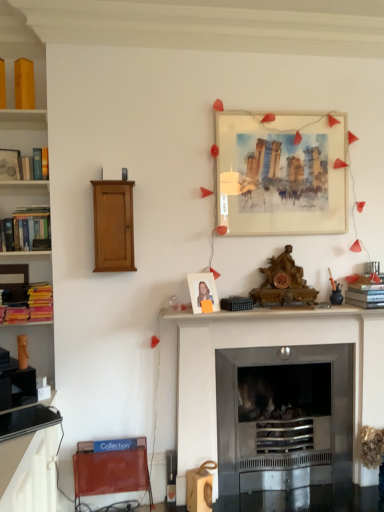
Identify the location of matte paper picture frame at upper center, which ranks as the second picture frame in front-to-back order. (280, 174).

You are a GUI agent. You are given a task and a screenshot of the screen. Output one action in this format:
    pyautogui.click(x=<x>, y=<y>)
    Task: Click on the hardcover books at left
    
    Given the screenshot: What is the action you would take?
    pyautogui.click(x=26, y=215)

In order to face hardcover book at left, the 1th book positioned from the top, should I rotate leftwards or rightwards?

Turn left approximately 20.259 degrees to face it.

What do you see at coordinates (268, 345) in the screenshot? I see `metallic silver fireplace at center` at bounding box center [268, 345].

You are a GUI agent. You are given a task and a screenshot of the screen. Output one action in this format:
    pyautogui.click(x=<x>, y=<y>)
    Task: Click on the matte paper picture frame at upper center, the second picture frame when ordered from left to right
    
    Given the screenshot: What is the action you would take?
    pyautogui.click(x=280, y=174)

Considering the relative sizes of matte white photo frame at center, which is the 1th picture frame from left to right, and hardcover book at left, the 1th book positioned from the top, in the image provided, is matte white photo frame at center, which is the 1th picture frame from left to right, shorter than hardcover book at left, the 1th book positioned from the top,?

No, matte white photo frame at center, which is the 1th picture frame from left to right, is not shorter than hardcover book at left, the 1th book positioned from the top.

Is matte white photo frame at center, which is the 1th picture frame from left to right, positioned behind hardcover book at left, the second book positioned from the right?

That is False.

From the image's perspective, which is below, matte white photo frame at center, which is the 2th picture frame from top to bottom, or hardcover book at left, arranged as the 1th book when viewed from the left?

matte white photo frame at center, which is the 2th picture frame from top to bottom, is shown below in the image.

The width and height of the screenshot is (384, 512). What are the coordinates of `the 2nd book above the matte white photo frame at center, the 1th picture frame ordered from the bottom (from the image's perspective)` in the screenshot? It's located at (21, 165).

From a real-world perspective, who is located lower, hardcover books at left or hardcover book at right, placed as the 2th book when sorted from top to bottom?

In real-world perspective, hardcover book at right, placed as the 2th book when sorted from top to bottom, is lower.

Based on the photo, is hardcover books at left positioned with its back to hardcover book at right, the second book positioned from the left?

No, hardcover books at left's orientation is not away from hardcover book at right, the second book positioned from the left.

Is hardcover books at left at the right side of hardcover book at right, the second book positioned from the left?

In fact, hardcover books at left is to the left of hardcover book at right, the second book positioned from the left.

Are hardcover books at left and hardcover book at right, the second book positioned from the left, beside each other?

No, hardcover books at left is not in contact with hardcover book at right, the second book positioned from the left.

Is point (247, 137) in front of point (382, 327)?

Yes.

In the scene shown: Considering the positions of objects matte paper picture frame at upper center, placed as the 1th picture frame when sorted from right to left, and metallic silver fireplace at center in the image provided, who is in front, matte paper picture frame at upper center, placed as the 1th picture frame when sorted from right to left, or metallic silver fireplace at center?

metallic silver fireplace at center.

Considering the sizes of objects matte paper picture frame at upper center, which ranks as the second picture frame in bottom-to-top order, and metallic silver fireplace at center in the image provided, who is thinner, matte paper picture frame at upper center, which ranks as the second picture frame in bottom-to-top order, or metallic silver fireplace at center?

matte paper picture frame at upper center, which ranks as the second picture frame in bottom-to-top order.

Does point (237, 232) come in front of point (214, 281)?

No, it is not.

Is matte paper picture frame at upper center, which ranks as the second picture frame in bottom-to-top order, shorter than matte white photo frame at center, which is the 2th picture frame from top to bottom?

In fact, matte paper picture frame at upper center, which ranks as the second picture frame in bottom-to-top order, may be taller than matte white photo frame at center, which is the 2th picture frame from top to bottom.

Does matte paper picture frame at upper center, the second picture frame when ordered from left to right, have a lesser width compared to matte white photo frame at center, the second picture frame positioned from the right?

No.

In the image, is matte paper picture frame at upper center, which ranks as the second picture frame in front-to-back order, positioned in front of or behind matte white photo frame at center, arranged as the second picture frame when viewed from the back?

matte paper picture frame at upper center, which ranks as the second picture frame in front-to-back order, is positioned farther from the viewer than matte white photo frame at center, arranged as the second picture frame when viewed from the back.

At what (x,y) coordinates should I click in order to perform the action: click on picture frame lying in front of the hardcover books at left. Please return your answer as a coordinate pair (x, y). Looking at the image, I should click on (202, 291).

Is the depth of hardcover books at left greater than that of matte white photo frame at center, which is the 2th picture frame from top to bottom?

Yes, hardcover books at left is further from the camera.

From a real-world perspective, who is located lower, hardcover books at left or matte white photo frame at center, which is the 1th picture frame from left to right?

matte white photo frame at center, which is the 1th picture frame from left to right, is physically lower.

Considering the sizes of hardcover books at left and matte white photo frame at center, arranged as the second picture frame when viewed from the back, in the image, is hardcover books at left bigger or smaller than matte white photo frame at center, arranged as the second picture frame when viewed from the back,?

In the image, hardcover books at left appears to be larger than matte white photo frame at center, arranged as the second picture frame when viewed from the back.

Which object is positioned more to the left, hardcover book at left, the 1th book positioned from the top, or matte paper picture frame at upper center, marked as the 1th picture frame in a back-to-front arrangement?

From the viewer's perspective, hardcover book at left, the 1th book positioned from the top, appears more on the left side.

Are hardcover book at left, the 1th book positioned from the top, and matte paper picture frame at upper center, which ranks as the second picture frame in bottom-to-top order, making contact?

No, hardcover book at left, the 1th book positioned from the top, is not touching matte paper picture frame at upper center, which ranks as the second picture frame in bottom-to-top order.

How different are the orientations of hardcover book at left, the second book positioned from the right, and matte paper picture frame at upper center, which ranks as the second picture frame in front-to-back order, in degrees?

6.59 degrees.

Based on their sizes in the image, would you say hardcover book at left, the 1th book positioned from the top, is bigger or smaller than matte paper picture frame at upper center, which is the 1th picture frame in top-to-bottom order?

Clearly, hardcover book at left, the 1th book positioned from the top, is smaller in size than matte paper picture frame at upper center, which is the 1th picture frame in top-to-bottom order.

From the picture: Is matte white photo frame at center, which is the 1th picture frame from left to right, oriented towards hardcover books at left?

No, matte white photo frame at center, which is the 1th picture frame from left to right, does not turn towards hardcover books at left.

Measure the distance between matte white photo frame at center, the second picture frame positioned from the right, and hardcover books at left.

The distance of matte white photo frame at center, the second picture frame positioned from the right, from hardcover books at left is 1.07 meters.

Does matte white photo frame at center, the second picture frame positioned from the right, have a greater height compared to hardcover books at left?

Incorrect, the height of matte white photo frame at center, the second picture frame positioned from the right, is not larger of that of hardcover books at left.

From a real-world perspective, who is located lower, matte white photo frame at center, arranged as the second picture frame when viewed from the back, or hardcover books at left?

In real-world perspective, matte white photo frame at center, arranged as the second picture frame when viewed from the back, is lower.

The height and width of the screenshot is (512, 384). What are the coordinates of `book above the matte white photo frame at center, the 1th picture frame ordered from the bottom (from a real-world perspective)` in the screenshot? It's located at (21, 165).

Locate an element on the screen. book below the hardcover books at left (from a real-world perspective) is located at coordinates (366, 292).

Consider the image. When comparing their distances from matte paper picture frame at upper center, placed as the 1th picture frame when sorted from right to left, does hardcover book at right, which is the 1th book from bottom to top, or hardcover book at left, arranged as the 1th book when viewed from the left, seem further?

Among the two, hardcover book at left, arranged as the 1th book when viewed from the left, is located further to matte paper picture frame at upper center, placed as the 1th picture frame when sorted from right to left.

Estimate the real-world distances between objects in this image. Which object is closer to hardcover books at left, hardcover book at right, placed as the 2th book when sorted from top to bottom, or hardcover book at left, the 1th book positioned from the top?

hardcover book at left, the 1th book positioned from the top, is closer to hardcover books at left.

From the image, which object appears to be farther from hardcover book at left, the 2th book positioned from the bottom, hardcover books at left or matte paper picture frame at upper center, which ranks as the second picture frame in bottom-to-top order?

Based on the image, matte paper picture frame at upper center, which ranks as the second picture frame in bottom-to-top order, appears to be further to hardcover book at left, the 2th book positioned from the bottom.

When comparing their distances from hardcover book at right, placed as the 2th book when sorted from top to bottom, does metallic silver fireplace at center or matte paper picture frame at upper center, which ranks as the second picture frame in bottom-to-top order, seem closer?

Based on the image, metallic silver fireplace at center appears to be nearer to hardcover book at right, placed as the 2th book when sorted from top to bottom.

Estimate the real-world distances between objects in this image. Which object is further from metallic silver fireplace at center, hardcover book at left, the 1th book positioned from the top, or matte paper picture frame at upper center, which ranks as the second picture frame in bottom-to-top order?

The object further to metallic silver fireplace at center is hardcover book at left, the 1th book positioned from the top.

Based on their spatial positions, is matte paper picture frame at upper center, the second picture frame when ordered from left to right, or hardcover books at left further from hardcover book at right, which is the 1th book from bottom to top?

hardcover books at left.

In the scene shown: Considering their positions, is matte white photo frame at center, arranged as the second picture frame when viewed from the back, positioned further to hardcover books at left than matte paper picture frame at upper center, which ranks as the second picture frame in bottom-to-top order?

matte paper picture frame at upper center, which ranks as the second picture frame in bottom-to-top order, lies further to hardcover books at left than the other object.

Based on their spatial positions, is matte paper picture frame at upper center, which is the 1th picture frame in top-to-bottom order, or hardcover books at left further from hardcover book at left, the 2th book positioned from the bottom?

matte paper picture frame at upper center, which is the 1th picture frame in top-to-bottom order, lies further to hardcover book at left, the 2th book positioned from the bottom, than the other object.

This screenshot has height=512, width=384. I want to click on fireplace between hardcover books at left and hardcover book at right, which is the 1th book from right to left, from left to right, so click(268, 345).

Where is `fireplace between hardcover book at left, arranged as the 1th book when viewed from the left, and hardcover book at right, placed as the 2th book when sorted from top to bottom`? fireplace between hardcover book at left, arranged as the 1th book when viewed from the left, and hardcover book at right, placed as the 2th book when sorted from top to bottom is located at coordinates (268, 345).

I want to click on picture frame situated between hardcover books at left and matte paper picture frame at upper center, placed as the 1th picture frame when sorted from right to left, from left to right, so click(x=202, y=291).

Locate an element on the screen. The width and height of the screenshot is (384, 512). book between hardcover books at left and metallic silver fireplace at center from left to right is located at coordinates (21, 165).